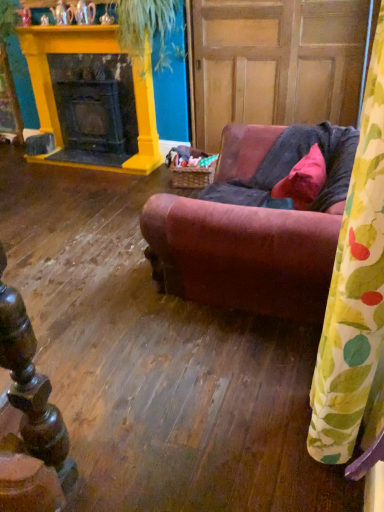
Find the location of a particular element. This screenshot has height=512, width=384. free region on the left part of yellow-green leaf-patterned curtain at right is located at coordinates (258, 434).